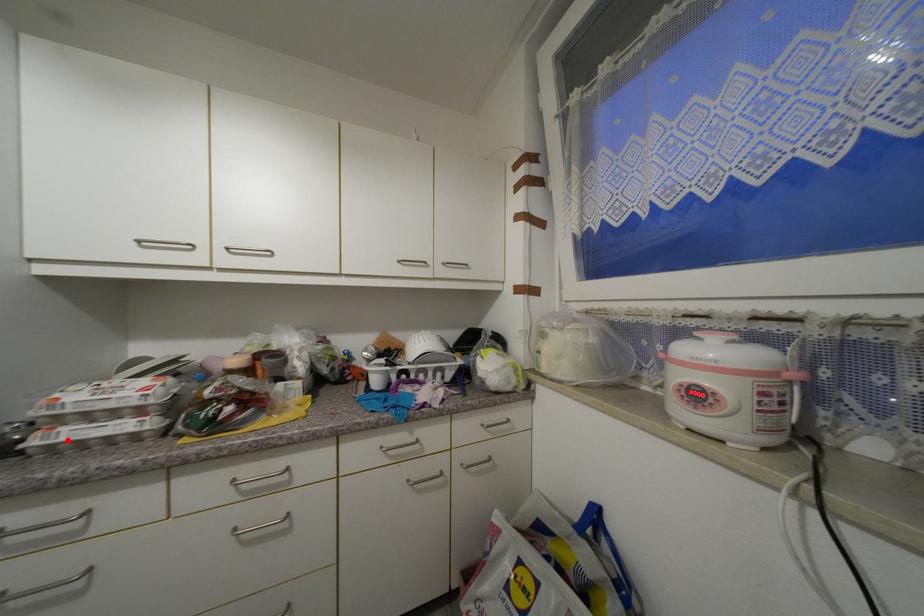
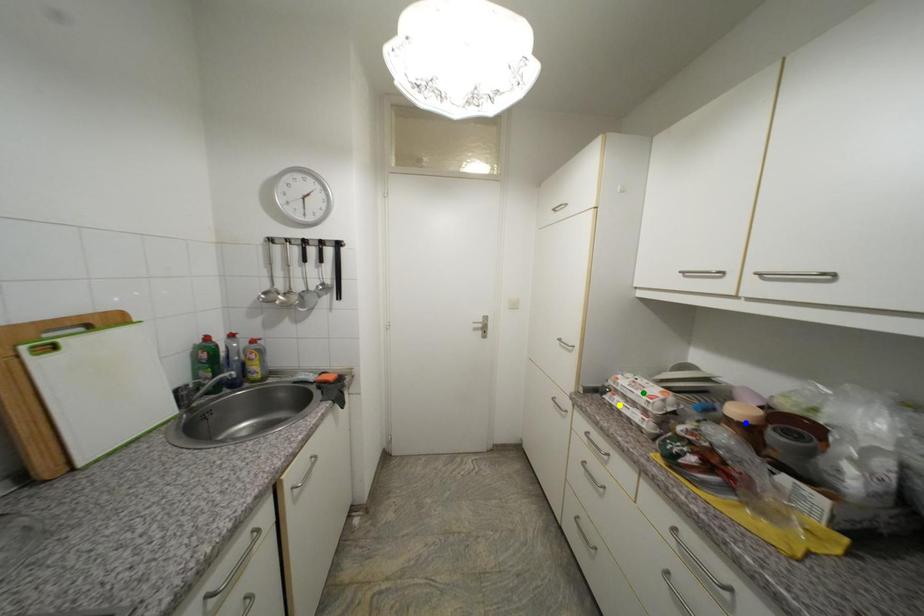
Question: I am providing you with two images of the same scene from different viewpoints. A red point is marked on the first image. You are given multiple points on the second image. In image 2, which mark is for the same physical point as the one in image 1?

Choices:
 (A) blue point
 (B) yellow point
 (C) green point

Answer: (B)